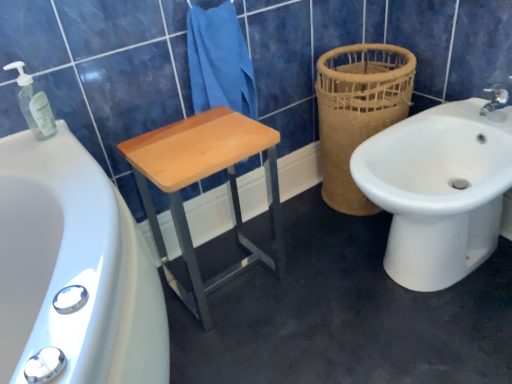
The width and height of the screenshot is (512, 384). I want to click on blue cotton towel at center, so pos(219,61).

The width and height of the screenshot is (512, 384). What do you see at coordinates (358, 112) in the screenshot?
I see `brown woven basket at right` at bounding box center [358, 112].

At what (x,y) coordinates should I click in order to perform the action: click on blue cotton towel at center. Please return your answer as a coordinate pair (x, y). The width and height of the screenshot is (512, 384). Looking at the image, I should click on (219, 61).

Is transparent plastic soap dispenser at upper left far away from brown woven basket at right?

No, transparent plastic soap dispenser at upper left is not far from brown woven basket at right.

Is transparent plastic soap dispenser at upper left oriented towards brown woven basket at right?

No, transparent plastic soap dispenser at upper left is not aimed at brown woven basket at right.

Is transparent plastic soap dispenser at upper left situated inside brown woven basket at right or outside?

transparent plastic soap dispenser at upper left is spatially situated outside brown woven basket at right.

Where is `soap dispenser in front of the brown woven basket at right`? This screenshot has width=512, height=384. soap dispenser in front of the brown woven basket at right is located at coordinates (34, 104).

Is there a large distance between white ceramic bidet at right and transparent plastic soap dispenser at upper left?

No, there isn't a large distance between white ceramic bidet at right and transparent plastic soap dispenser at upper left.

From the image's perspective, is white ceramic bidet at right below transparent plastic soap dispenser at upper left?

Yes, from the image's perspective, white ceramic bidet at right is below transparent plastic soap dispenser at upper left.

In the scene shown: How much distance is there between white ceramic bidet at right and transparent plastic soap dispenser at upper left?

white ceramic bidet at right is 38.84 inches from transparent plastic soap dispenser at upper left.

From a real-world perspective, which object stands above the other?

brown woven basket at right.

Can you tell me how much brown woven basket at right and light wood/matte stool at center differ in facing direction?

There is a 93.3-degree angle between the facing directions of brown woven basket at right and light wood/matte stool at center.

Is the depth of brown woven basket at right less than that of light wood/matte stool at center?

No, it is not.

Is brown woven basket at right aimed at light wood/matte stool at center?

Yes, brown woven basket at right is facing light wood/matte stool at center.

Is blue cotton towel at center in front of or behind transparent plastic soap dispenser at upper left in the image?

Clearly, blue cotton towel at center is behind transparent plastic soap dispenser at upper left.

From a real-world perspective, is blue cotton towel at center located higher than transparent plastic soap dispenser at upper left?

No, from a real-world perspective, blue cotton towel at center is not on top of transparent plastic soap dispenser at upper left.

Looking at this image, considering the relative sizes of blue cotton towel at center and transparent plastic soap dispenser at upper left in the image provided, is blue cotton towel at center smaller than transparent plastic soap dispenser at upper left?

No, blue cotton towel at center is not smaller than transparent plastic soap dispenser at upper left.

Which is in front, point (229, 64) or point (29, 81)?

The point (29, 81) is in front.

From a real-world perspective, does blue cotton towel at center stand above white ceramic bidet at right?

Yes, from a real-world perspective, blue cotton towel at center is above white ceramic bidet at right.

Is blue cotton towel at center not near white ceramic bidet at right?

No, blue cotton towel at center is not far from white ceramic bidet at right.

Looking at the image, does blue cotton towel at center seem bigger or smaller compared to white ceramic bidet at right?

blue cotton towel at center is smaller than white ceramic bidet at right.

Considering the positions of objects blue cotton towel at center and white ceramic bidet at right in the image provided, who is more to the right, blue cotton towel at center or white ceramic bidet at right?

Positioned to the right is white ceramic bidet at right.

Which object is positioned more to the left, transparent plastic soap dispenser at upper left or white ceramic bidet at right?

transparent plastic soap dispenser at upper left is more to the left.

Does transparent plastic soap dispenser at upper left come in front of white ceramic bidet at right?

No, transparent plastic soap dispenser at upper left is further to the viewer.

From the image's perspective, between transparent plastic soap dispenser at upper left and white ceramic bidet at right, who is located below?

white ceramic bidet at right is shown below in the image.

Can we say transparent plastic soap dispenser at upper left lies outside white ceramic bidet at right?

transparent plastic soap dispenser at upper left lies outside white ceramic bidet at right's area.

Does light wood/matte stool at center have a greater width compared to brown woven basket at right?

In fact, light wood/matte stool at center might be narrower than brown woven basket at right.

Which object is further away from the camera taking this photo, light wood/matte stool at center or brown woven basket at right?

brown woven basket at right.

In the scene shown: From a real-world perspective, which is physically above, light wood/matte stool at center or brown woven basket at right?

From a 3D spatial view, brown woven basket at right is above.

Consider the image. How far apart are light wood/matte stool at center and brown woven basket at right?

light wood/matte stool at center is 15.96 inches away from brown woven basket at right.

At what (x,y) coordinates should I click in order to perform the action: click on soap dispenser that appears on the left of brown woven basket at right. Please return your answer as a coordinate pair (x, y). Looking at the image, I should click on (34, 104).

Where is `soap dispenser located behind the white ceramic bidet at right`? The height and width of the screenshot is (384, 512). soap dispenser located behind the white ceramic bidet at right is located at coordinates (34, 104).

Which object lies further to the anchor point brown woven basket at right, blue cotton towel at center or light wood/matte stool at center?

light wood/matte stool at center.

Estimate the real-world distances between objects in this image. Which object is further from light wood/matte stool at center, brown woven basket at right or blue cotton towel at center?

brown woven basket at right.

Considering their positions, is white ceramic bidet at right positioned closer to brown woven basket at right than light wood/matte stool at center?

white ceramic bidet at right is closer to brown woven basket at right.

Estimate the real-world distances between objects in this image. Which object is further from blue cotton towel at center, transparent plastic soap dispenser at upper left or white ceramic bidet at right?

white ceramic bidet at right is positioned further to the anchor blue cotton towel at center.

From the image, which object appears to be farther from blue cotton towel at center, light wood/matte stool at center or transparent plastic soap dispenser at upper left?

transparent plastic soap dispenser at upper left is further to blue cotton towel at center.

From the image, which object appears to be farther from blue cotton towel at center, light wood/matte stool at center or white ceramic bidet at right?

white ceramic bidet at right lies further to blue cotton towel at center than the other object.

Based on their spatial positions, is blue cotton towel at center or light wood/matte stool at center further from white ceramic bidet at right?

The object further to white ceramic bidet at right is blue cotton towel at center.

From the image, which object appears to be nearer to transparent plastic soap dispenser at upper left, white ceramic bidet at right or brown woven basket at right?

brown woven basket at right lies closer to transparent plastic soap dispenser at upper left than the other object.

Where is `basket between transparent plastic soap dispenser at upper left and white ceramic bidet at right in the horizontal direction`? basket between transparent plastic soap dispenser at upper left and white ceramic bidet at right in the horizontal direction is located at coordinates (358, 112).

You are a GUI agent. You are given a task and a screenshot of the screen. Output one action in this format:
    pyautogui.click(x=<x>, y=<y>)
    Task: Click on the basket situated between light wood/matte stool at center and white ceramic bidet at right from left to right
    Image resolution: width=512 pixels, height=384 pixels.
    Given the screenshot: What is the action you would take?
    pyautogui.click(x=358, y=112)

This screenshot has height=384, width=512. Find the location of `bath towel between transparent plastic soap dispenser at upper left and brown woven basket at right from left to right`. bath towel between transparent plastic soap dispenser at upper left and brown woven basket at right from left to right is located at coordinates (219, 61).

The width and height of the screenshot is (512, 384). Identify the location of bath towel between light wood/matte stool at center and brown woven basket at right. (219, 61).